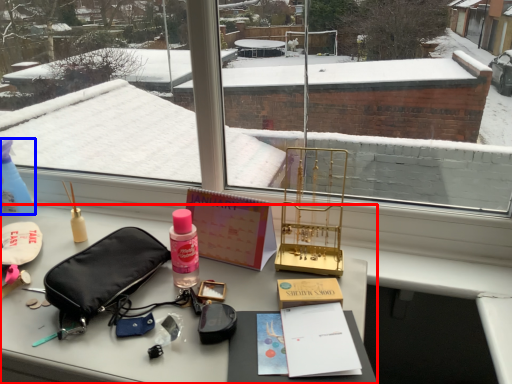
Question: Which object appears closest to the camera in this image, desk (highlighted by a red box) or bottle (highlighted by a blue box)?

Choices:
 (A) desk
 (B) bottle

Answer: (A)